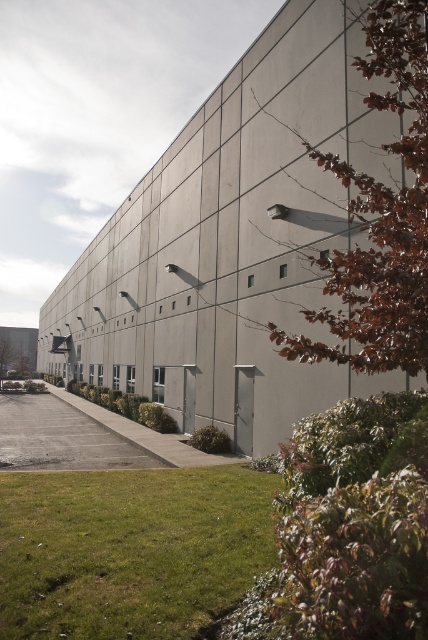
Question: Does gray concrete building at center come behind green grass at lower left?

Choices:
 (A) yes
 (B) no

Answer: (B)

Question: Is gray concrete building at center below green grass at lower left?

Choices:
 (A) yes
 (B) no

Answer: (B)

Question: Which of the following is the closest to the observer?

Choices:
 (A) (118, 476)
 (B) (249, 211)

Answer: (A)

Question: Among these objects, which one is farthest from the camera?

Choices:
 (A) gray concrete building at center
 (B) green grass at lower left

Answer: (B)

Question: Does gray concrete building at center appear over green grass at lower left?

Choices:
 (A) no
 (B) yes

Answer: (B)